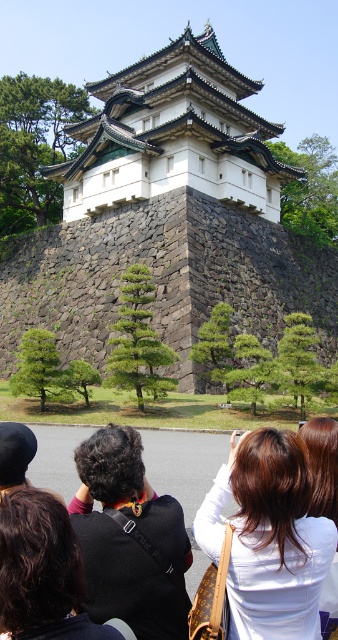
Between point (44, 611) and point (315, 470), which one is positioned in front?

Point (44, 611)

Who is positioned more to the left, black fabric at lower left or shiny brown hair at center?

black fabric at lower left

In order to click on black fabric at lower left in this screenshot , I will do `click(41, 570)`.

Between white matte shirt at center and black fabric at lower left, which one has less height?

Standing shorter between the two is black fabric at lower left.

This screenshot has width=338, height=640. Find the location of `white matte shirt at center`. white matte shirt at center is located at coordinates (269, 538).

Locate an element on the screen. The height and width of the screenshot is (640, 338). white matte shirt at center is located at coordinates click(269, 538).

Who is positioned more to the left, white stone building at center or white matte shirt at center?

white stone building at center

In the scene shown: Is white stone building at center thinner than white matte shirt at center?

No, white stone building at center is not thinner than white matte shirt at center.

Who is more distant from viewer, (x=207, y=100) or (x=253, y=502)?

The point (x=207, y=100) is behind.

The width and height of the screenshot is (338, 640). Find the location of `white stone building at center`. white stone building at center is located at coordinates (174, 134).